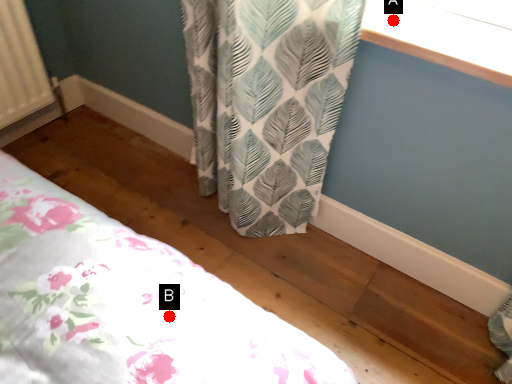
Question: Two points are circled on the image, labeled by A and B beside each circle. Which point is closer to the camera taking this photo?

Choices:
 (A) A is closer
 (B) B is closer

Answer: (B)